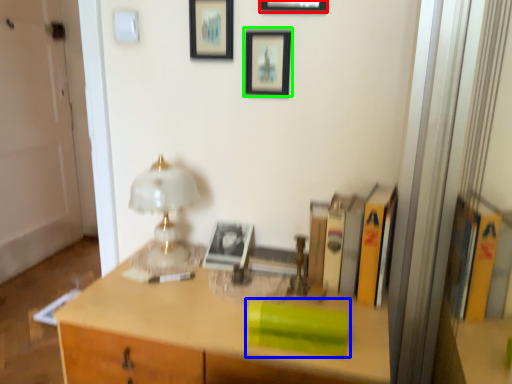
Question: Which object is the farthest from picture frame (highlighted by a red box)? Choose among these: book (highlighted by a blue box) or picture frame (highlighted by a green box).

Choices:
 (A) book
 (B) picture frame

Answer: (A)